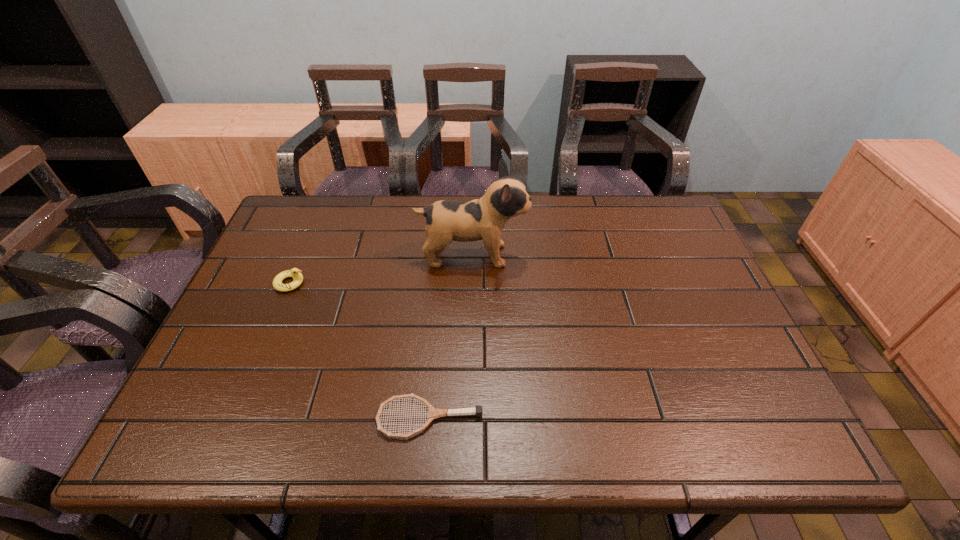
I want to click on the farthest object, so click(x=483, y=219).

Locate an element on the screen. This screenshot has height=540, width=960. the tallest object is located at coordinates (483, 219).

Image resolution: width=960 pixels, height=540 pixels. Identify the location of the leftmost object. click(x=295, y=273).

The height and width of the screenshot is (540, 960). I want to click on the second nearest object, so coord(295,273).

This screenshot has width=960, height=540. I want to click on the shortest object, so click(x=433, y=413).

At what (x,y) coordinates should I click in order to perform the action: click on the nearest object. Please return your answer as a coordinate pair (x, y). This screenshot has width=960, height=540. Looking at the image, I should click on (433, 413).

At what (x,y) coordinates should I click in order to perform the action: click on free space located at the face of the puppy. Please return your answer as a coordinate pair (x, y). Looking at the image, I should click on (575, 255).

Where is `free region located 0.290m on the face of the duckling`? free region located 0.290m on the face of the duckling is located at coordinates (413, 283).

Identify the location of vacant space situated on the right of the nearest object. (636, 418).

At what (x,y) coordinates should I click in order to perform the action: click on object located in the far edge section of the desktop. Please return your answer as a coordinate pair (x, y). This screenshot has height=540, width=960. Looking at the image, I should click on (483, 219).